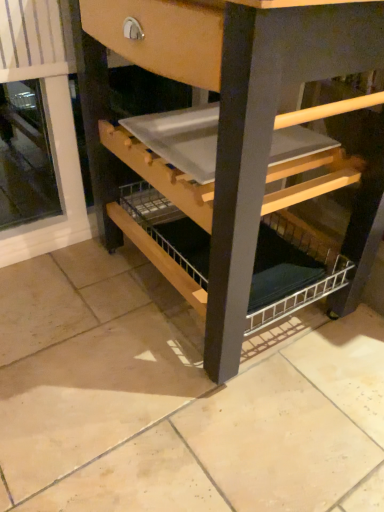
This screenshot has height=512, width=384. What are the coordinates of `free space in front of wooden tray at center` in the screenshot? It's located at (197, 421).